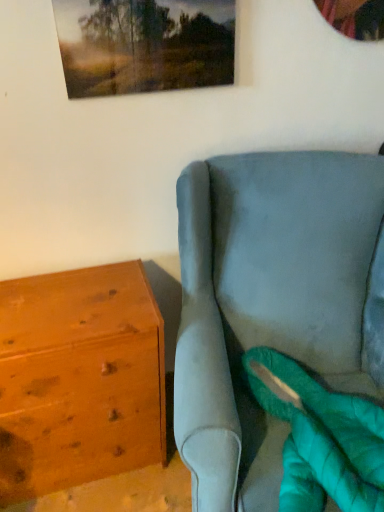
Question: Should I look upward or downward to see wooden chest of drawers at left?

Choices:
 (A) up
 (B) down

Answer: (B)

Question: Is matte wooden picture frame at upper center touching wooden chest of drawers at left?

Choices:
 (A) no
 (B) yes

Answer: (A)

Question: Considering the relative sizes of matte wooden picture frame at upper center and wooden chest of drawers at left in the image provided, is matte wooden picture frame at upper center smaller than wooden chest of drawers at left?

Choices:
 (A) yes
 (B) no

Answer: (A)

Question: Considering the relative sizes of matte wooden picture frame at upper center and wooden chest of drawers at left in the image provided, is matte wooden picture frame at upper center bigger than wooden chest of drawers at left?

Choices:
 (A) no
 (B) yes

Answer: (A)

Question: Does matte wooden picture frame at upper center contain wooden chest of drawers at left?

Choices:
 (A) yes
 (B) no

Answer: (B)

Question: Does matte wooden picture frame at upper center have a lesser height compared to wooden chest of drawers at left?

Choices:
 (A) no
 (B) yes

Answer: (B)

Question: From a real-world perspective, is matte wooden picture frame at upper center positioned under wooden chest of drawers at left based on gravity?

Choices:
 (A) no
 (B) yes

Answer: (A)

Question: Is wooden chest of drawers at left not near matte wooden picture frame at upper center?

Choices:
 (A) no
 (B) yes

Answer: (A)

Question: Does wooden chest of drawers at left have a larger size compared to matte wooden picture frame at upper center?

Choices:
 (A) yes
 (B) no

Answer: (A)

Question: Is wooden chest of drawers at left smaller than matte wooden picture frame at upper center?

Choices:
 (A) yes
 (B) no

Answer: (B)

Question: Is wooden chest of drawers at left closer to camera compared to matte wooden picture frame at upper center?

Choices:
 (A) no
 (B) yes

Answer: (A)

Question: Does wooden chest of drawers at left have a lesser width compared to matte wooden picture frame at upper center?

Choices:
 (A) no
 (B) yes

Answer: (A)

Question: Is wooden chest of drawers at left shorter than matte wooden picture frame at upper center?

Choices:
 (A) no
 (B) yes

Answer: (A)

Question: Considering the positions of matte wooden picture frame at upper center and wooden chest of drawers at left in the image, is matte wooden picture frame at upper center bigger or smaller than wooden chest of drawers at left?

Choices:
 (A) small
 (B) big

Answer: (A)